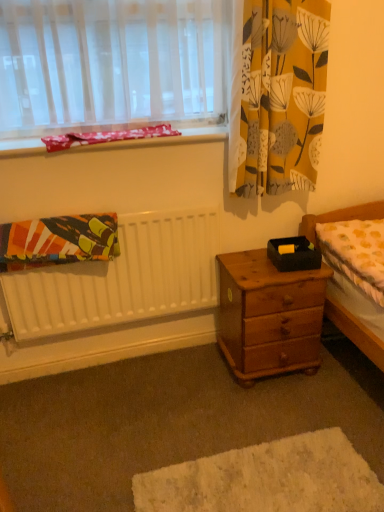
The width and height of the screenshot is (384, 512). In order to click on vacant space underneath white matte radiator at left (from a real-world perspective) in this screenshot , I will do `click(118, 358)`.